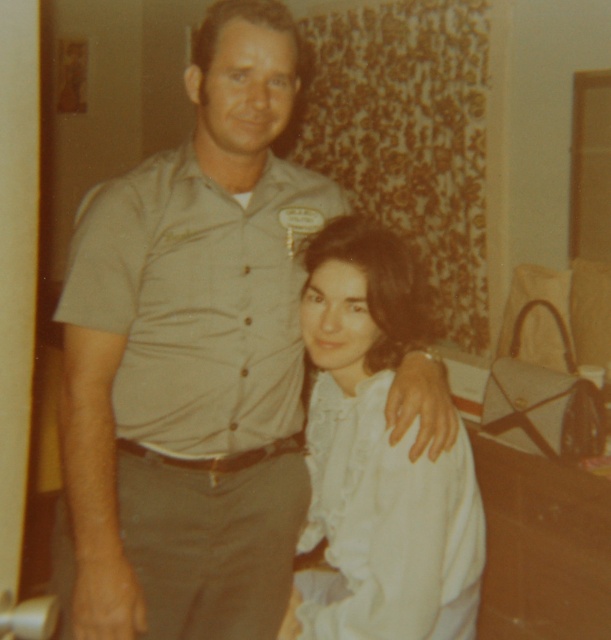
Question: Which of the following is the closest to the observer?

Choices:
 (A) matte khaki shirt at center
 (B) white ruffled blouse at center

Answer: (B)

Question: Considering the relative positions of matte khaki shirt at center and white ruffled blouse at center in the image provided, where is matte khaki shirt at center located with respect to white ruffled blouse at center?

Choices:
 (A) above
 (B) below

Answer: (A)

Question: Is matte khaki shirt at center bigger than white ruffled blouse at center?

Choices:
 (A) no
 (B) yes

Answer: (B)

Question: Does matte khaki shirt at center have a smaller size compared to white ruffled blouse at center?

Choices:
 (A) yes
 (B) no

Answer: (B)